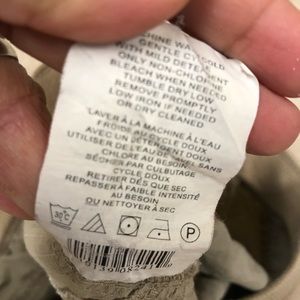
The image size is (300, 300). Identify the location of fabric. (107, 287), (158, 295).